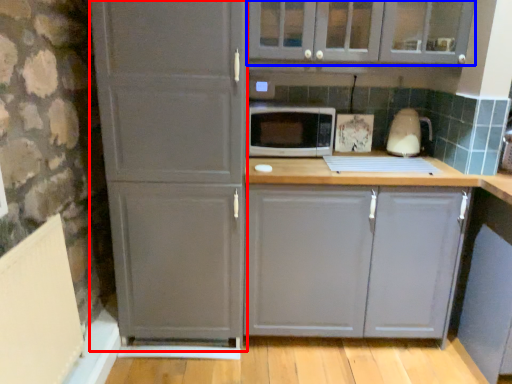
Question: Which object is closer to the camera taking this photo, screen door (highlighted by a red box) or cabinetry (highlighted by a blue box)?

Choices:
 (A) screen door
 (B) cabinetry

Answer: (A)